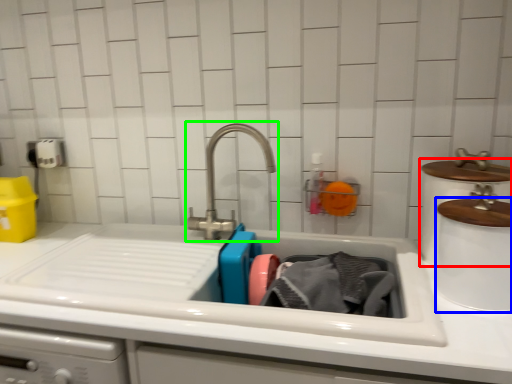
Question: Which object is positioned closest to appliance (highlighted by a red box)? Select from appliance (highlighted by a blue box) and tap (highlighted by a green box).

Choices:
 (A) appliance
 (B) tap

Answer: (A)